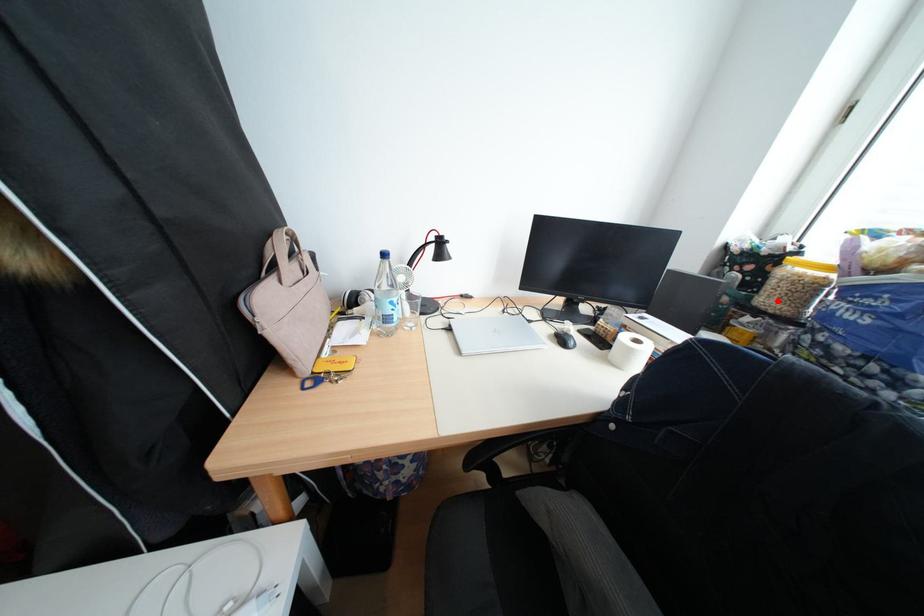
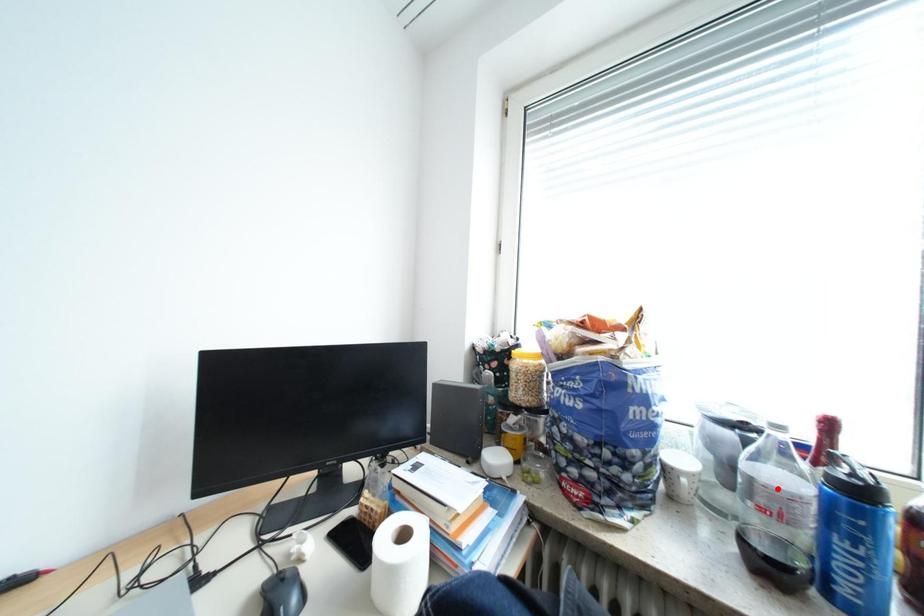
I am providing you with two images of the same scene from different viewpoints. A red point is marked on the first image and another point is marked on the second image. Do the highlighted points in image1 and image2 indicate the same real-world spot?

No